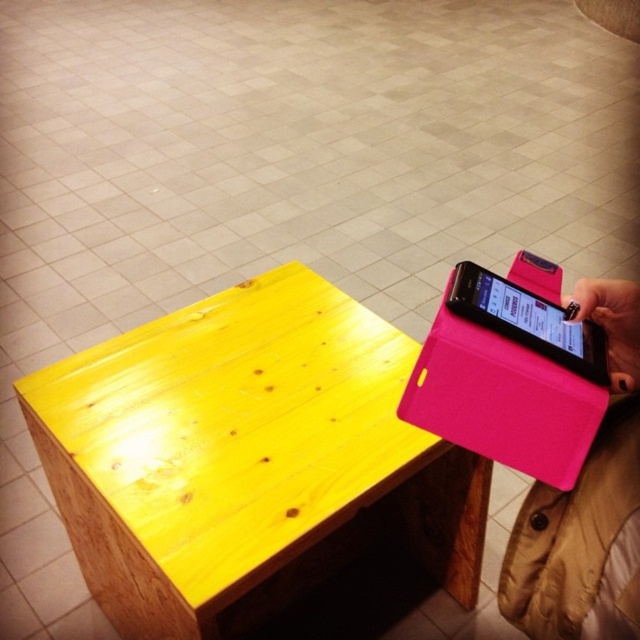
Is point (636, 342) less distant than point (572, 310)?

Yes, it is in front of point (572, 310).

From the picture: Does pink leather wallet at lower right have a larger size compared to matte black smartphone at upper right?

Yes, pink leather wallet at lower right is bigger than matte black smartphone at upper right.

This screenshot has height=640, width=640. I want to click on pink leather wallet at lower right, so click(x=586, y=506).

Image resolution: width=640 pixels, height=640 pixels. Find the location of `pink leather wallet at lower right`. pink leather wallet at lower right is located at coordinates (586, 506).

Does yellow wood table at upper left have a lesser height compared to pink leather wallet at lower right?

Incorrect, yellow wood table at upper left's height does not fall short of pink leather wallet at lower right's.

Is the position of yellow wood table at upper left less distant than that of pink leather wallet at lower right?

No.

Which is in front, point (432, 532) or point (580, 548)?

Positioned in front is point (580, 548).

The image size is (640, 640). I want to click on yellow wood table at upper left, so click(246, 458).

Which of these two, yellow wood table at upper left or matte black smartphone at upper right, stands taller?

With more height is yellow wood table at upper left.

Is point (144, 604) closer to viewer compared to point (592, 340)?

No, (144, 604) is behind (592, 340).

This screenshot has height=640, width=640. What do you see at coordinates (246, 458) in the screenshot?
I see `yellow wood table at upper left` at bounding box center [246, 458].

Identify the location of yellow wood table at upper left. (246, 458).